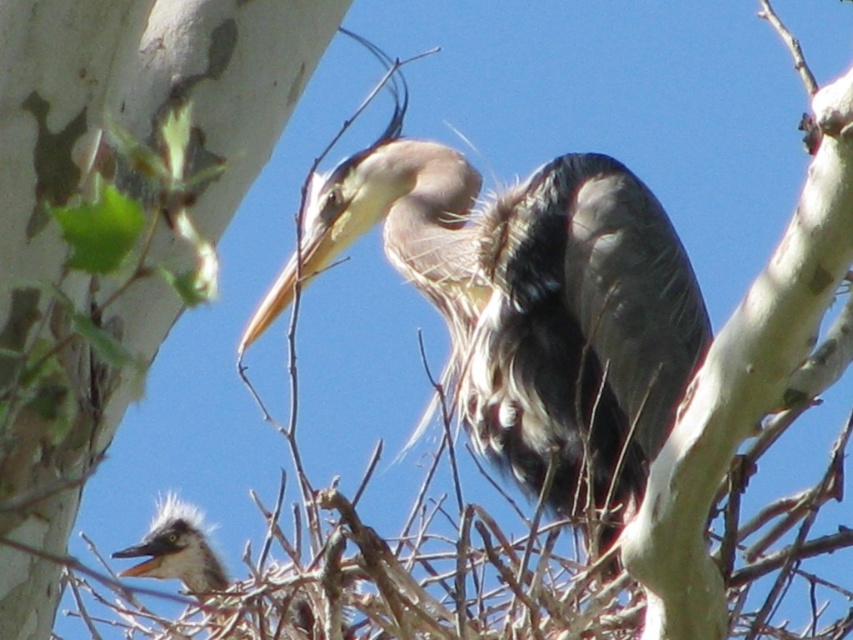
Measure the distance between point (445, 282) and camera.

10.16 feet

Describe the element at coordinates (531, 307) in the screenshot. The height and width of the screenshot is (640, 853). I see `gray feathered heron at center` at that location.

Image resolution: width=853 pixels, height=640 pixels. Describe the element at coordinates (531, 307) in the screenshot. I see `gray feathered heron at center` at that location.

Locate an element on the screen. gray feathered heron at center is located at coordinates (531, 307).